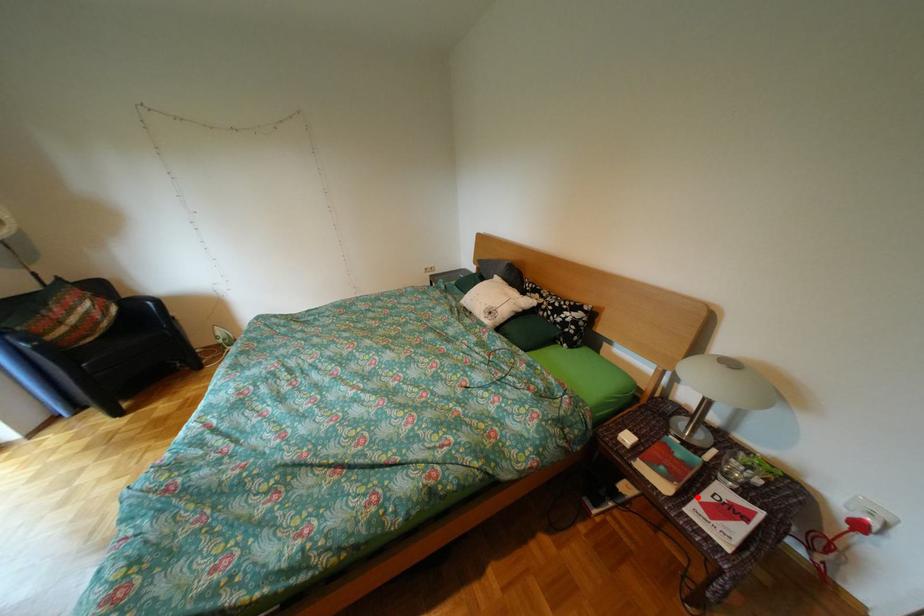
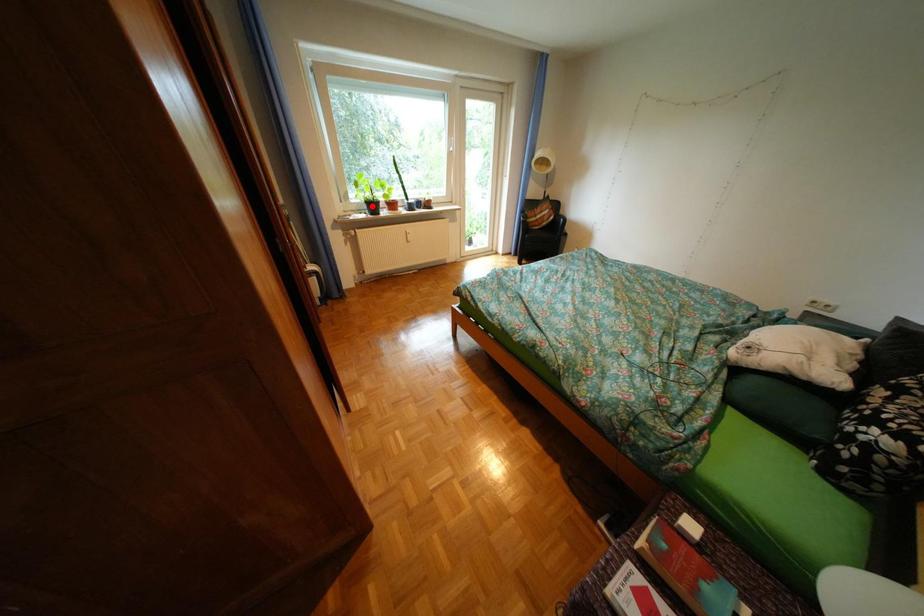
I am providing you with two images of the same scene from different viewpoints. A red point is marked on the first image and another point is marked on the second image. Do the highlighted points in image1 and image2 indicate the same real-world spot?

No